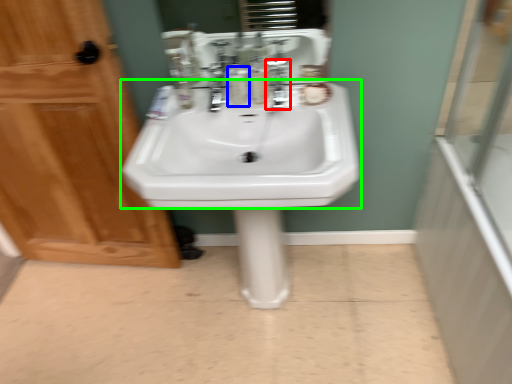
Question: Estimate the real-world distances between objects in this image. Which object is closer to plumbing fixture (highlighted by a red box), mouthwash (highlighted by a blue box) or sink (highlighted by a green box)?

Choices:
 (A) mouthwash
 (B) sink

Answer: (A)